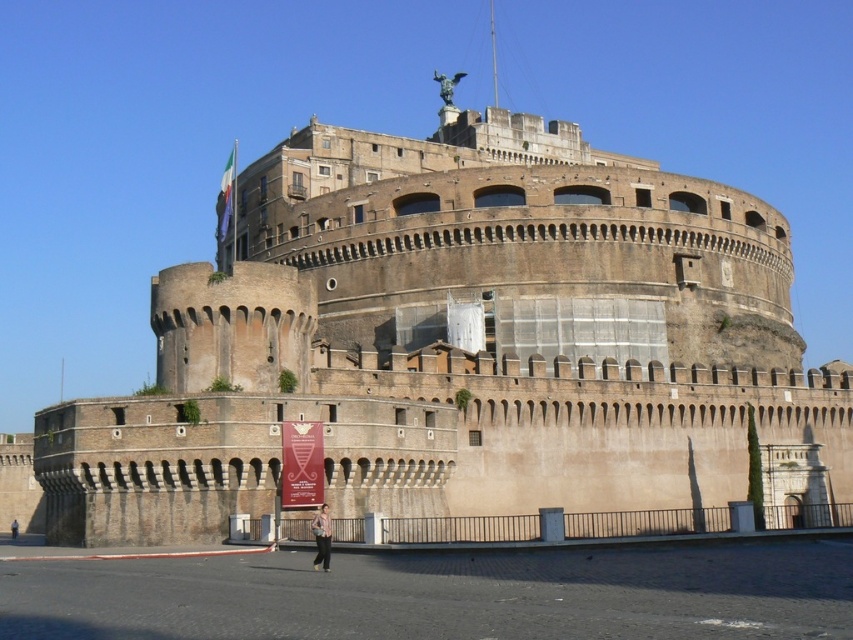
You are a drone operator tasked with capturing aerial footage of the brown stone castle at center. The drone has a maximum flight range of 40 meters. Can the drone safely return to you after taking photos without needing a recharge?

The distance between the brown stone castle at center and the camera is 41.92 meters, which exceeds the drone maximum flight range of 40 meters. The drone cannot safely return without needing a recharge.

Based on the photo, what is the 2D coordinate of the brown stone castle at center?

The brown stone castle at center is located at the 2D coordinate point of (456, 340).

You are a tourist visiting the fortress and want to take a photo that includes both the brown stone castle at center and the striped cotton shirt at lower center. Which object should you position closer to the camera to ensure both are clearly visible in the frame?

To ensure both the brown stone castle at center and the striped cotton shirt at lower center are clearly visible, position the striped cotton shirt at lower center closer to the camera since it is smaller in size and the castle is larger, allowing both to fit within the frame without one overpowering the other.